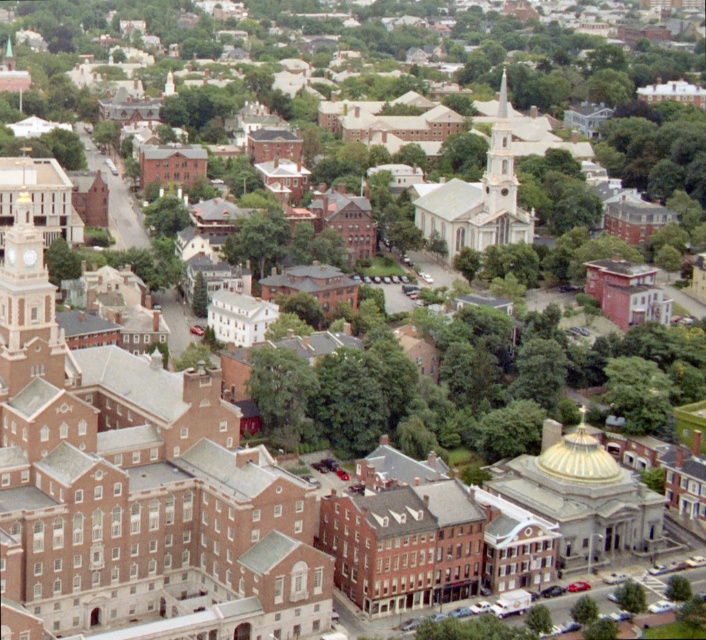
Measure the distance from matte brick clock tower at left to green leafy tree at lower right.

They are 245.79 feet apart.

Can you confirm if matte brick clock tower at left is shorter than green leafy tree at lower right?

No.

The height and width of the screenshot is (640, 706). Find the location of `matte brick clock tower at left`. matte brick clock tower at left is located at coordinates (28, 308).

The width and height of the screenshot is (706, 640). I want to click on matte brick clock tower at left, so click(x=28, y=308).